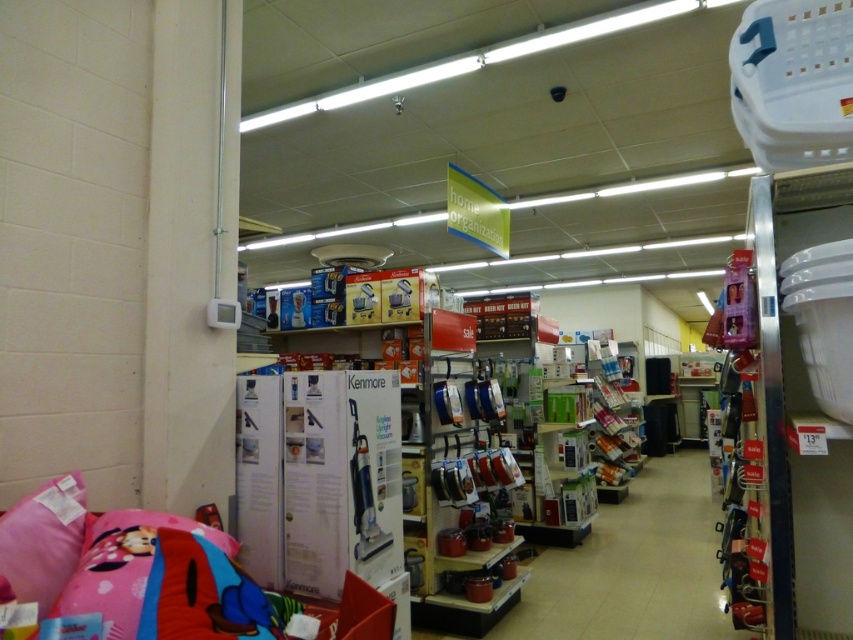
Is matte pink pillow at lower left to the left of pink fabric pillow at lower left from the viewer's perspective?

In fact, matte pink pillow at lower left is to the right of pink fabric pillow at lower left.

Where is `matte pink pillow at lower left`? The width and height of the screenshot is (853, 640). matte pink pillow at lower left is located at coordinates (164, 580).